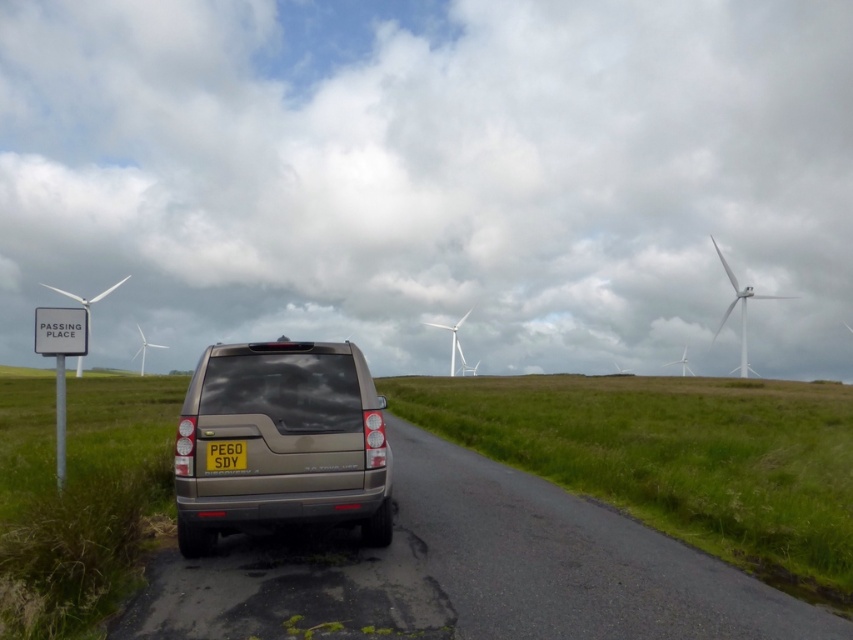
Describe the element at coordinates (451, 336) in the screenshot. This screenshot has height=640, width=853. I see `white plastic wind turbine at center` at that location.

Is white plastic wind turbine at center positioned in front of white matte windmill at center?

Yes, white plastic wind turbine at center is in front of white matte windmill at center.

Is point (457, 323) farther from camera compared to point (143, 356)?

That is False.

I want to click on white plastic wind turbine at center, so click(x=451, y=336).

How distant is gold metallic suv at center from white plastic wind turbine at center?

gold metallic suv at center and white plastic wind turbine at center are 83.76 meters apart.

Does gold metallic suv at center have a greater height compared to white plastic wind turbine at center?

Incorrect, gold metallic suv at center's height is not larger of white plastic wind turbine at center's.

Who is more distant from viewer, [194,435] or [451,358]?

The point [451,358] is more distant.

Locate an element on the screen. This screenshot has width=853, height=640. gold metallic suv at center is located at coordinates (282, 442).

Between white matte wind turbine at right and white matte windmill at center, which one appears on the right side from the viewer's perspective?

From the viewer's perspective, white matte wind turbine at right appears more on the right side.

Is point (715, 332) more distant than point (143, 353)?

That is True.

Which is in front, point (729, 275) or point (138, 369)?

Point (729, 275) is in front.

Image resolution: width=853 pixels, height=640 pixels. I want to click on white matte wind turbine at right, so click(x=740, y=307).